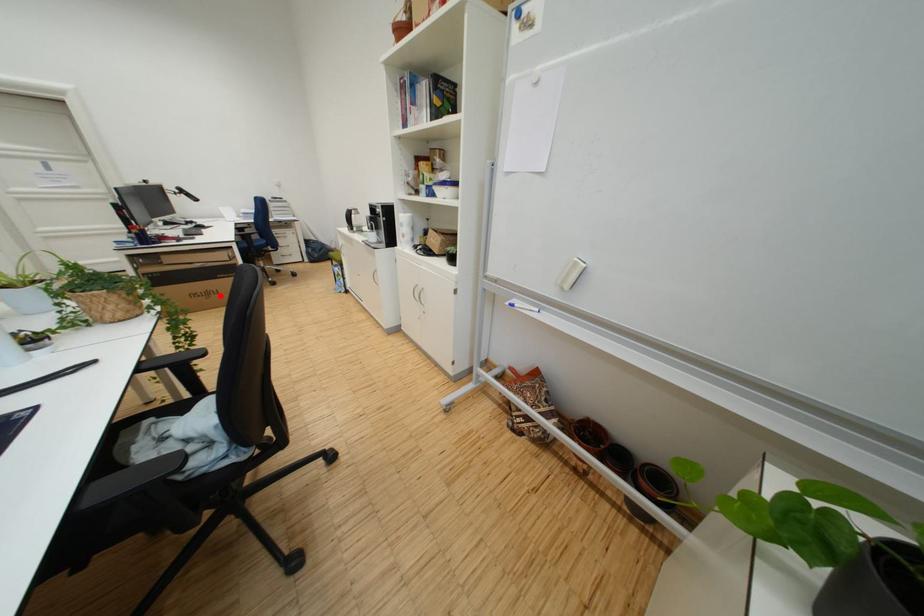
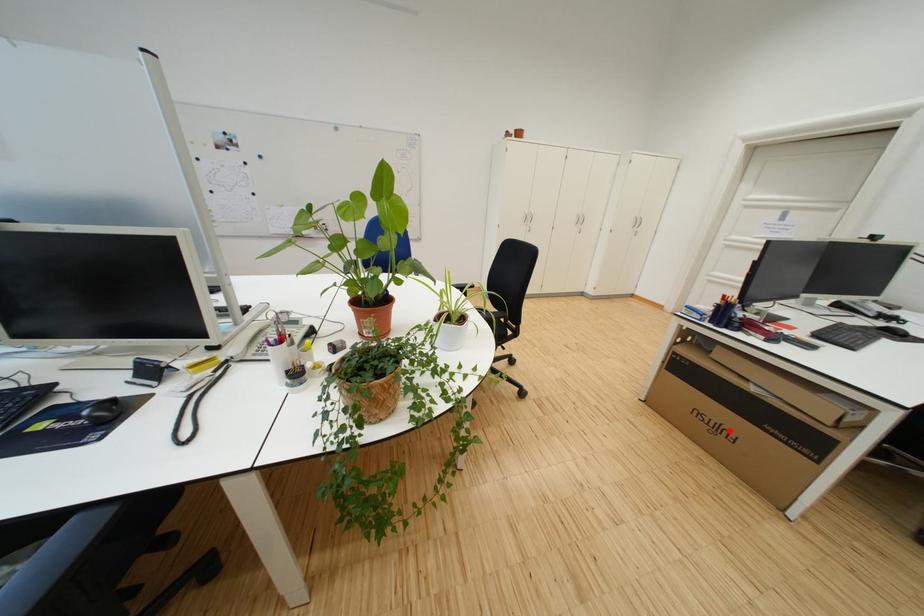
I am providing you with two images of the same scene from different viewpoints. A red point is marked on the first image and another point is marked on the second image. Are the points marked in image1 and image2 representing the same 3D position?

Yes